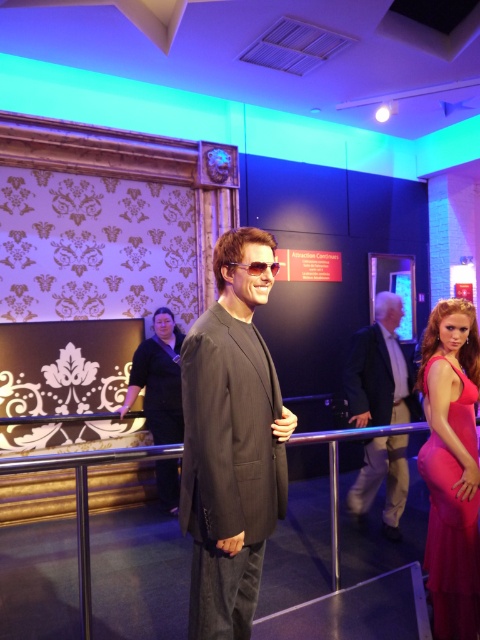
You are a museum guide and need to describe the central figure to a visitor. Which object, the black fabric dress at center or the sunglasses at center, has a greater width?

The black fabric dress at center is wider than the sunglasses at center according to the description provided.

You are a visitor at the wax museum and want to take a photo of both the matte black suit at center and the matte pink dress at right. Which object should you focus on first to ensure both are in frame?

You should focus on the matte black suit at center first because it is taller than the matte pink dress at right, so positioning it properly will help ensure both fit within the frame.

In the scene shown: You are standing in the wax museum and want to take a photo of both the central wax figure and the sign that says Attraction Continues. You notice two points marked in the scene. Which point is closer to you, point (223, 326) or point (466, 406)?

Point (223, 326) is closer to the camera than point (466, 406), so it is closer to you.